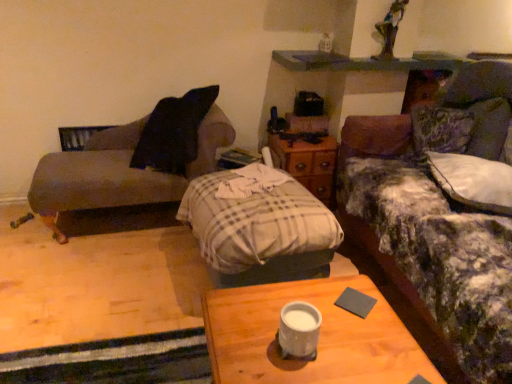
Question: Is plaid fabric pillow at center wider than gray matte pad at center?

Choices:
 (A) yes
 (B) no

Answer: (A)

Question: Are plaid fabric pillow at center and gray matte pad at center beside each other?

Choices:
 (A) yes
 (B) no

Answer: (B)

Question: Can you confirm if plaid fabric pillow at center is positioned to the right of gray matte pad at center?

Choices:
 (A) no
 (B) yes

Answer: (A)

Question: Could gray matte pad at center be considered to be inside plaid fabric pillow at center?

Choices:
 (A) yes
 (B) no

Answer: (B)

Question: Is plaid fabric pillow at center positioned with its back to gray matte pad at center?

Choices:
 (A) yes
 (B) no

Answer: (B)

Question: Visually, is wooden desk at center positioned to the left or to the right of matte brown couch at left, which is the 1th studio couch from left to right?

Choices:
 (A) left
 (B) right

Answer: (B)

Question: In the image, is wooden desk at center positioned in front of or behind matte brown couch at left, which is the second studio couch in right-to-left order?

Choices:
 (A) front
 (B) behind

Answer: (A)

Question: Is wooden desk at center wider or thinner than matte brown couch at left, which is the second studio couch in right-to-left order?

Choices:
 (A) thin
 (B) wide

Answer: (B)

Question: From a real-world perspective, relative to matte brown couch at left, which is the 1th studio couch from left to right, is wooden desk at center vertically above or below?

Choices:
 (A) above
 (B) below

Answer: (B)

Question: From a real-world perspective, relative to wooden nightstand at center, is matte brown couch at left, which is the 1th studio couch from left to right, vertically above or below?

Choices:
 (A) below
 (B) above

Answer: (B)

Question: Looking at the image, does matte brown couch at left, which is the second studio couch in right-to-left order, seem bigger or smaller compared to wooden nightstand at center?

Choices:
 (A) small
 (B) big

Answer: (B)

Question: Would you say matte brown couch at left, which is the second studio couch in right-to-left order, is to the left or to the right of wooden nightstand at center in the picture?

Choices:
 (A) right
 (B) left

Answer: (B)

Question: Considering the positions of matte brown couch at left, which is the second studio couch in right-to-left order, and wooden nightstand at center in the image, is matte brown couch at left, which is the second studio couch in right-to-left order, wider or thinner than wooden nightstand at center?

Choices:
 (A) thin
 (B) wide

Answer: (B)

Question: From their relative heights in the image, would you say fluffy fabric couch at right, marked as the 1th studio couch in a right-to-left arrangement, is taller or shorter than white matte coffee cup at center?

Choices:
 (A) tall
 (B) short

Answer: (A)

Question: Relative to white matte coffee cup at center, is fluffy fabric couch at right, the 2th studio couch viewed from the left, in front or behind?

Choices:
 (A) front
 (B) behind

Answer: (A)